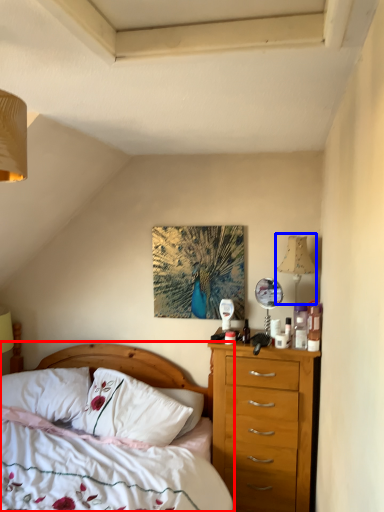
Question: Among these objects, which one is farthest to the camera, bed (highlighted by a red box) or lamp (highlighted by a blue box)?

Choices:
 (A) bed
 (B) lamp

Answer: (B)